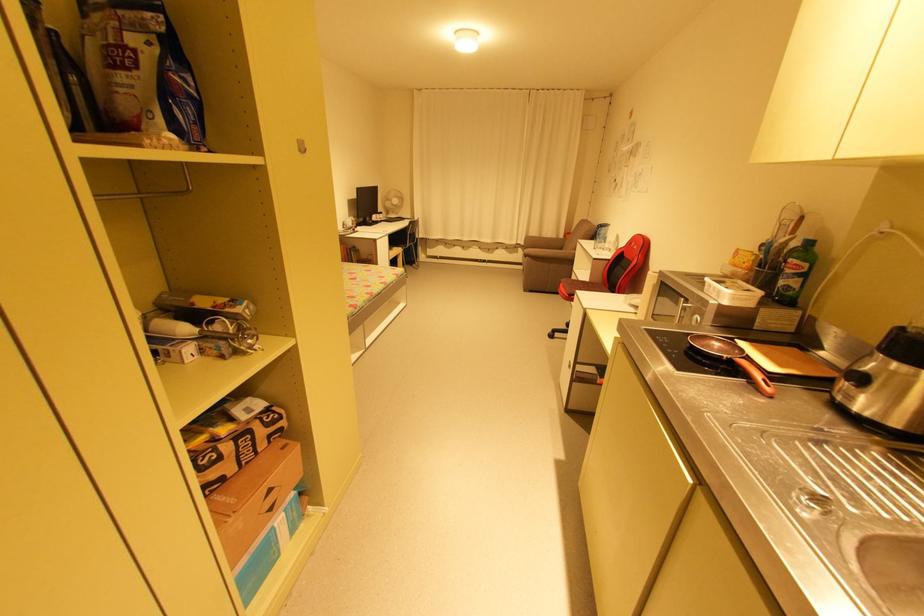
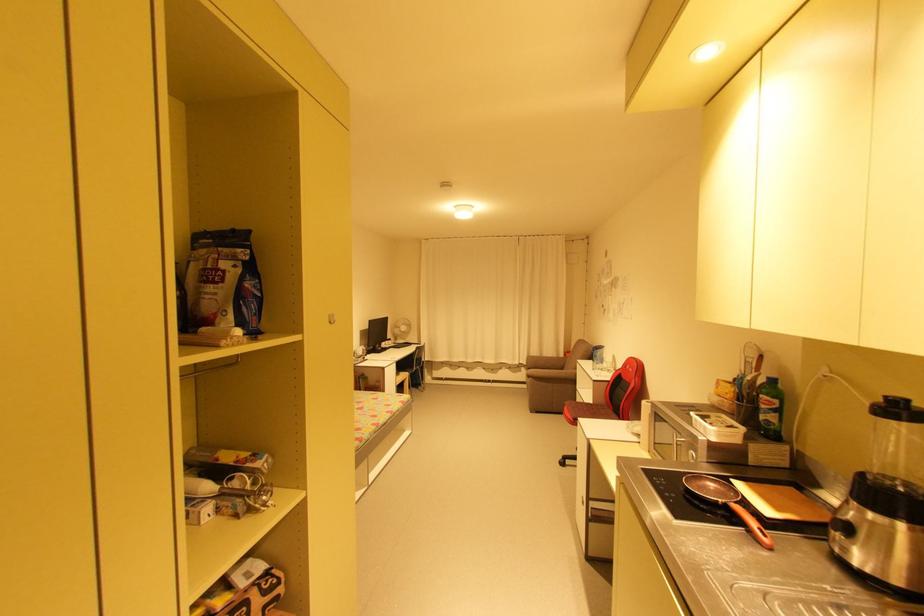
The point at (x=880, y=416) is marked in the first image. Where is the corresponding point in the second image?

(878, 570)